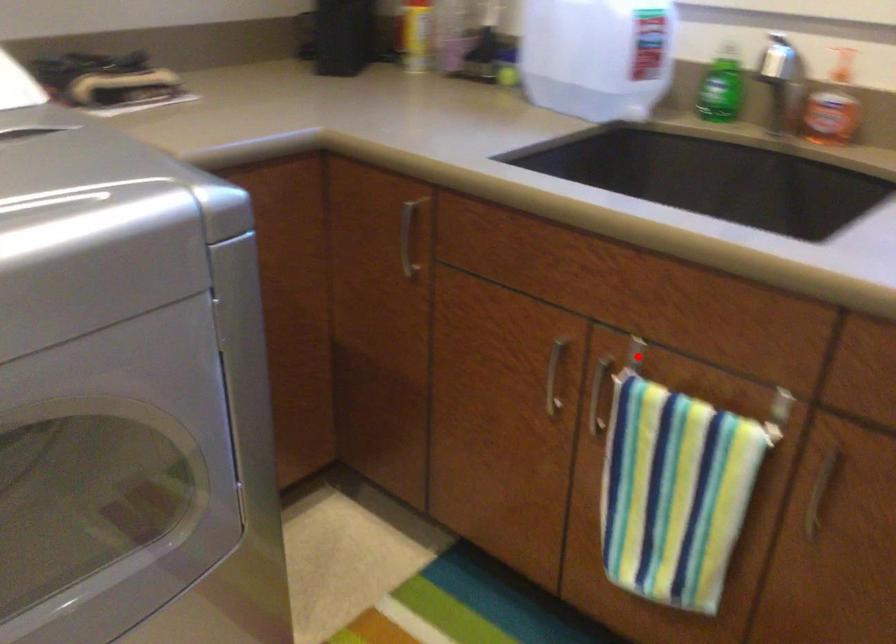
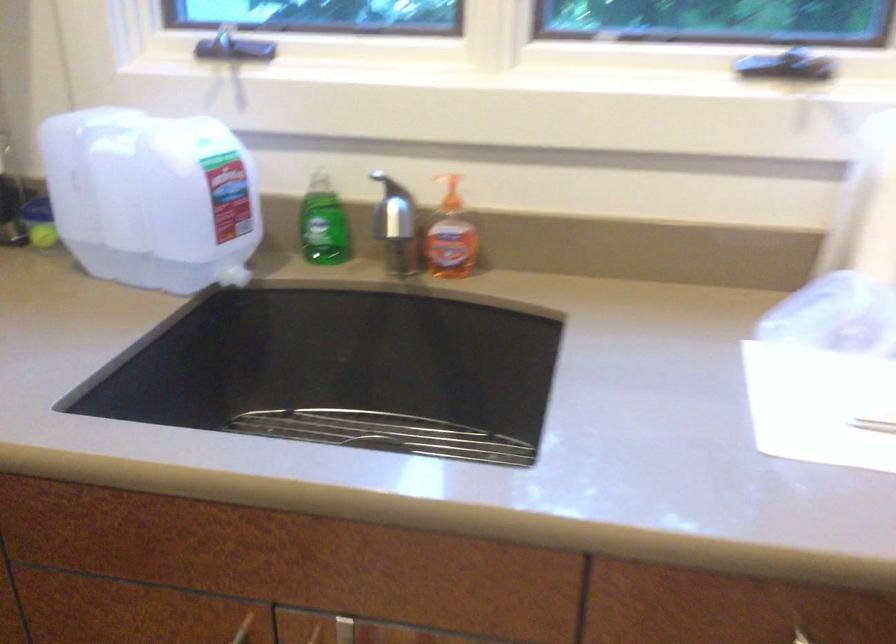
Locate, in the second image, the point that corresponds to the highlighted location in the first image.

(343, 630)